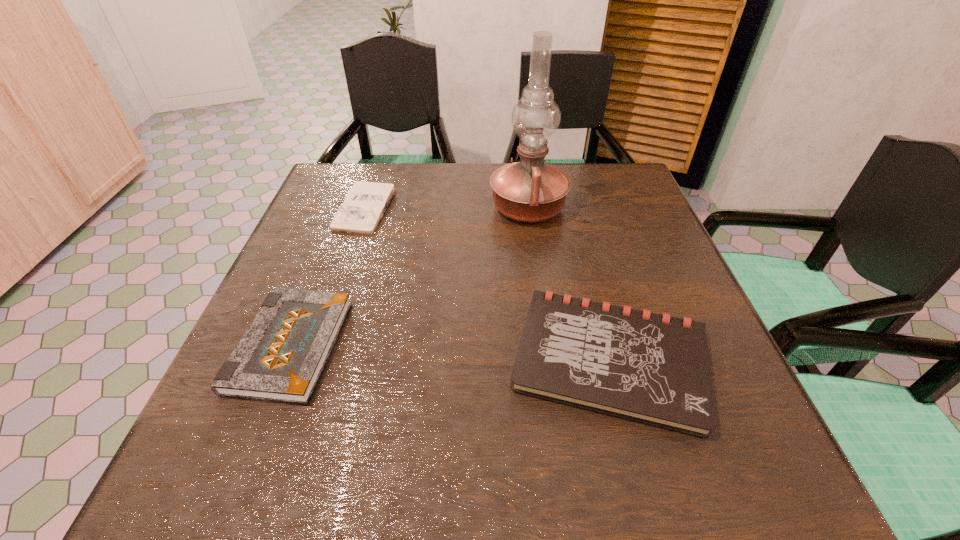
The height and width of the screenshot is (540, 960). What are the coordinates of `object located in the far left corner section of the desktop` in the screenshot? It's located at [x=363, y=207].

The height and width of the screenshot is (540, 960). Find the location of `vacant space at the far edge of the desktop`. vacant space at the far edge of the desktop is located at coordinates tap(430, 201).

What are the coordinates of `vacant position at the near edge of the desktop` in the screenshot? It's located at (339, 475).

This screenshot has width=960, height=540. In the image, there is a desktop. What are the coordinates of `vacant space at the left edge` in the screenshot? It's located at (288, 286).

Where is `vacant area at the right edge`? vacant area at the right edge is located at coordinates (640, 233).

In the image, there is a desktop. Identify the location of vacant space at the far left corner. The image size is (960, 540). (367, 181).

Find the location of a particular element. The width and height of the screenshot is (960, 540). free space at the near left corner is located at coordinates (229, 462).

Find the location of a particular element. The image size is (960, 540). vacant space at the far right corner of the desktop is located at coordinates (608, 180).

In the image, there is a desktop. Identify the location of free space at the near right corner. (754, 449).

Where is `free space between the tallest object and the shortest object`? The width and height of the screenshot is (960, 540). free space between the tallest object and the shortest object is located at coordinates (x=447, y=208).